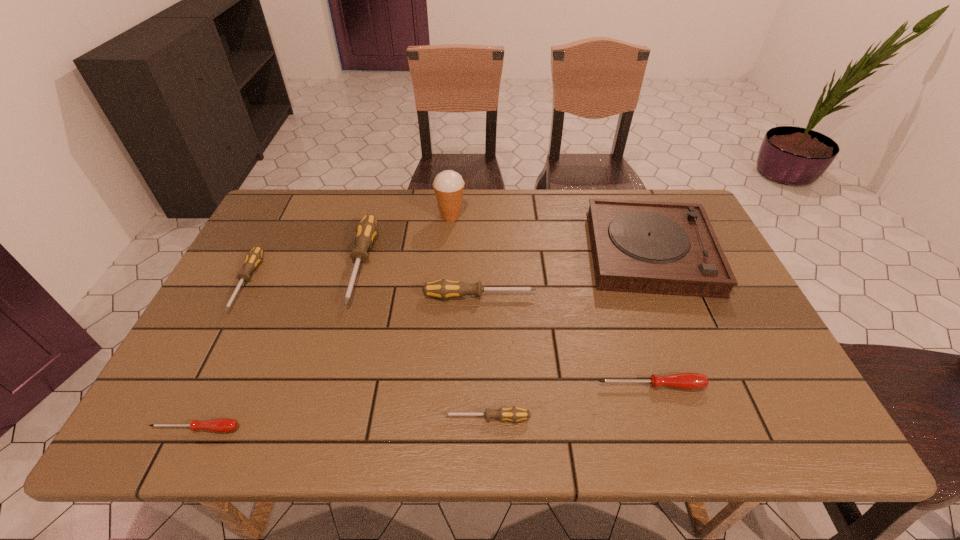
The height and width of the screenshot is (540, 960). In order to click on free spot between the leftmost gray screwdriver and the icecream in this screenshot , I will do `click(348, 249)`.

This screenshot has width=960, height=540. I want to click on free space between the third object from left to right and the third biggest gray screwdriver, so click(x=304, y=274).

Identify which object is located as the third nearest to the leftmost gray screwdriver. Please provide its 2D coordinates. Your answer should be formatted as a tuple, i.e. [(x, y)], where the tuple contains the x and y coordinates of a point satisfying the conditions above.

[(443, 289)]

Identify which object is the fourth nearest to the phonograph record. Please provide its 2D coordinates. Your answer should be formatted as a tuple, i.e. [(x, y)], where the tuple contains the x and y coordinates of a point satisfying the conditions above.

[(514, 414)]

Locate an element on the screen. screwdriver that is the fourth closest to the third biggest gray screwdriver is located at coordinates (514, 414).

Locate an element on the screen. This screenshot has height=540, width=960. screwdriver that can be found as the closest to the biggest gray screwdriver is located at coordinates (443, 289).

The image size is (960, 540). What are the coordinates of `gray screwdriver identified as the third closest to the left red screwdriver` in the screenshot? It's located at (514, 414).

Find the location of a particular element. The width and height of the screenshot is (960, 540). gray screwdriver that is the closest one to the icecream is located at coordinates (366, 230).

Identify the location of vacant area in the image that satisfies the following two spatial constraints: 1. on the back side of the phonograph record; 2. on the left side of the shortest object. The width and height of the screenshot is (960, 540). (280, 252).